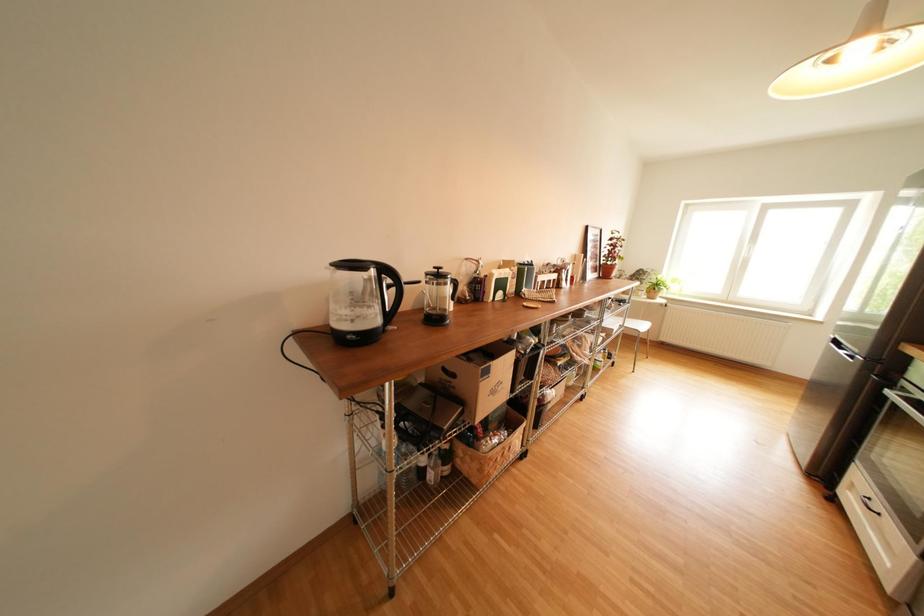
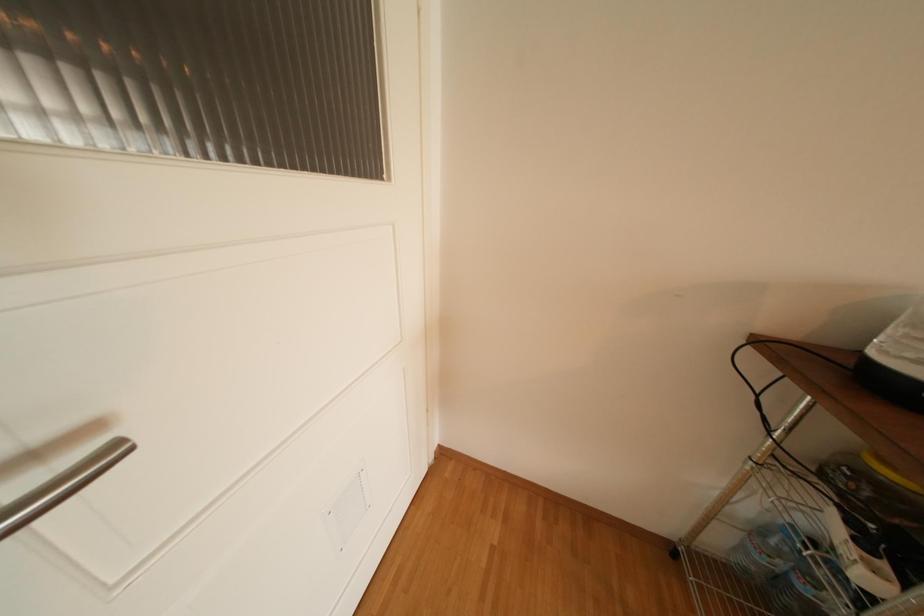
Based on the continuous images, in which direction is the camera rotating?

The camera rotated toward left-down.